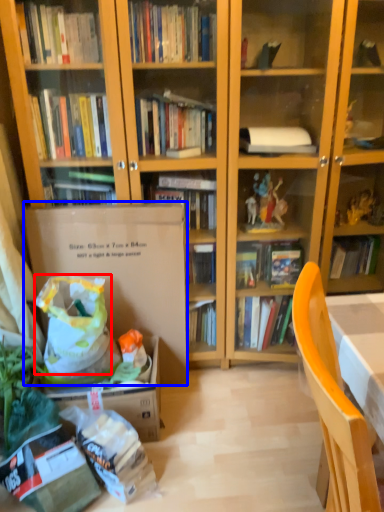
Question: Which point is closer to the camera, grocery bag (highlighted by a red box) or paperback book (highlighted by a blue box)?

Choices:
 (A) grocery bag
 (B) paperback book

Answer: (A)